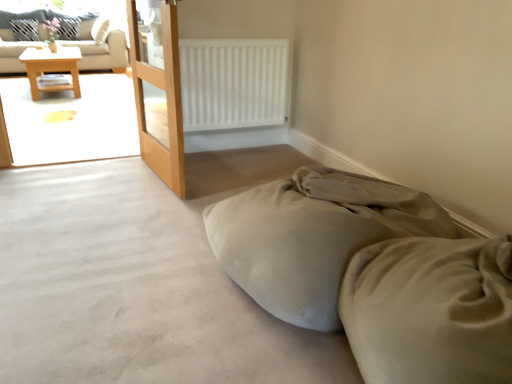
Question: Is white matte radiator at upper center behind suede-like beige bed at lower right?

Choices:
 (A) no
 (B) yes

Answer: (B)

Question: From the image's perspective, does white matte radiator at upper center appear higher than suede-like beige bed at lower right?

Choices:
 (A) yes
 (B) no

Answer: (A)

Question: Is white matte radiator at upper center not near suede-like beige bed at lower right?

Choices:
 (A) yes
 (B) no

Answer: (A)

Question: Could suede-like beige bed at lower right be considered to be inside white matte radiator at upper center?

Choices:
 (A) yes
 (B) no

Answer: (B)

Question: From a real-world perspective, is white matte radiator at upper center located beneath suede-like beige bed at lower right?

Choices:
 (A) no
 (B) yes

Answer: (A)

Question: Can you confirm if white matte radiator at upper center is shorter than suede-like beige bed at lower right?

Choices:
 (A) no
 (B) yes

Answer: (A)

Question: Is the surface of beige fabric couch at upper left in direct contact with wooden table at left?

Choices:
 (A) yes
 (B) no

Answer: (B)

Question: Could you tell me if beige fabric couch at upper left is facing wooden table at left?

Choices:
 (A) yes
 (B) no

Answer: (A)

Question: From a real-world perspective, does beige fabric couch at upper left sit lower than wooden table at left?

Choices:
 (A) no
 (B) yes

Answer: (A)

Question: Does beige fabric couch at upper left have a larger size compared to wooden table at left?

Choices:
 (A) yes
 (B) no

Answer: (A)

Question: From the image's perspective, is beige fabric couch at upper left located above wooden table at left?

Choices:
 (A) no
 (B) yes

Answer: (B)

Question: Is beige fabric couch at upper left closer to camera compared to wooden table at left?

Choices:
 (A) yes
 (B) no

Answer: (B)

Question: From the image's perspective, is beige fabric couch at upper left over white fabric pillow at upper left, which is the second pillow in right-to-left order?

Choices:
 (A) yes
 (B) no

Answer: (B)